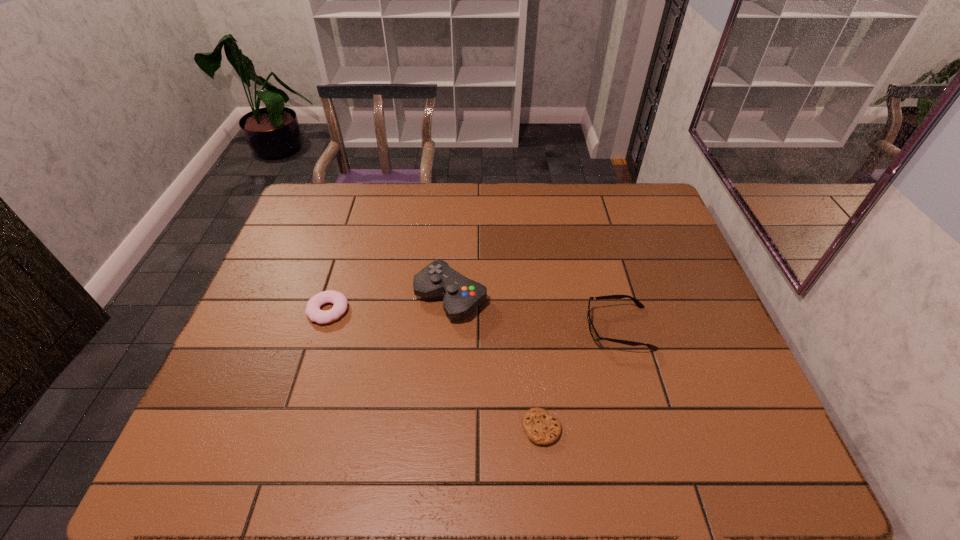
This screenshot has height=540, width=960. I want to click on empty space that is in between the spectacles and the second object from left to right, so click(x=535, y=313).

Where is `the closest object relative to the control`? the closest object relative to the control is located at coordinates (340, 302).

This screenshot has height=540, width=960. What are the coordinates of `the third closest object relative to the tallest object` in the screenshot? It's located at (593, 332).

The image size is (960, 540). In order to click on free spot that satisfies the following two spatial constraints: 1. on the front side of the second object from right to left; 2. on the left side of the doughnut in this screenshot , I will do `click(292, 428)`.